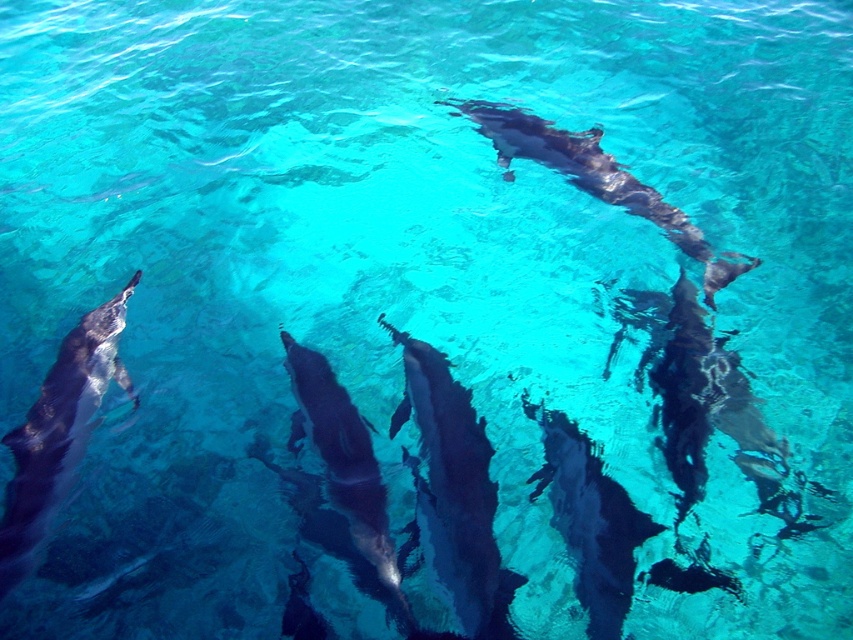
Question: Observing the image, what is the correct spatial positioning of glossy dark gray dolphin at center in reference to smooth gray dolphin at center?

Choices:
 (A) below
 (B) above

Answer: (B)

Question: Which point appears closest to the camera in this image?

Choices:
 (A) (335, 440)
 (B) (473, 449)

Answer: (B)

Question: Which of the following is the farthest from the observer?

Choices:
 (A) (509, 176)
 (B) (482, 621)
 (C) (323, 397)

Answer: (A)

Question: Does glossy dark gray dolphin at center appear over glossy dark gray dolphin at upper center?

Choices:
 (A) no
 (B) yes

Answer: (A)

Question: From the image, what is the correct spatial relationship of smooth gray dolphin at center in relation to shiny dark gray dolphin at center?

Choices:
 (A) below
 (B) above

Answer: (A)

Question: Considering the real-world distances, which object is farthest from the shiny dark gray dolphin at lower left?

Choices:
 (A) shiny dark gray dolphin at center
 (B) glossy dark gray dolphin at upper center
 (C) smooth gray dolphin at center
 (D) glossy dark gray dolphin at center

Answer: (B)